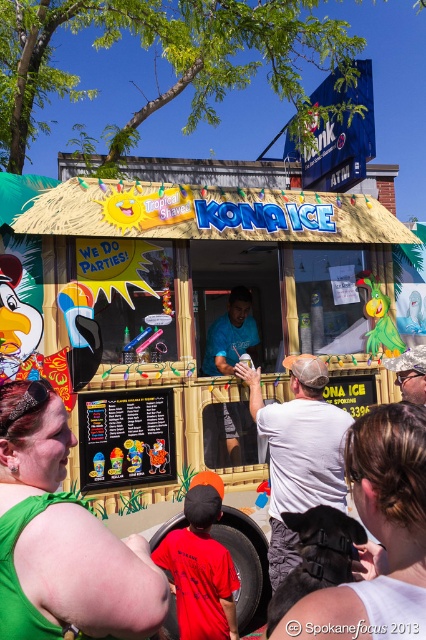
Question: Does green fabric dress at lower left have a greater width compared to white matte ice cream at center?

Choices:
 (A) no
 (B) yes

Answer: (A)

Question: Among these points, which one is nearest to the camera?

Choices:
 (A) (134, 598)
 (B) (111, 332)
 (C) (308, 484)

Answer: (A)

Question: Can you confirm if matte wooden food truck at center is smaller than green fabric dress at lower left?

Choices:
 (A) yes
 (B) no

Answer: (B)

Question: Is the position of matte wooden food truck at center less distant than that of white matte ice cream at center?

Choices:
 (A) yes
 (B) no

Answer: (B)

Question: Which object appears closest to the camera in this image?

Choices:
 (A) matte wooden food truck at center
 (B) white matte ice cream at center
 (C) green fabric dress at lower left

Answer: (C)

Question: Considering the real-world distances, which object is farthest from the green fabric dress at lower left?

Choices:
 (A) white matte ice cream at center
 (B) matte wooden food truck at center

Answer: (B)